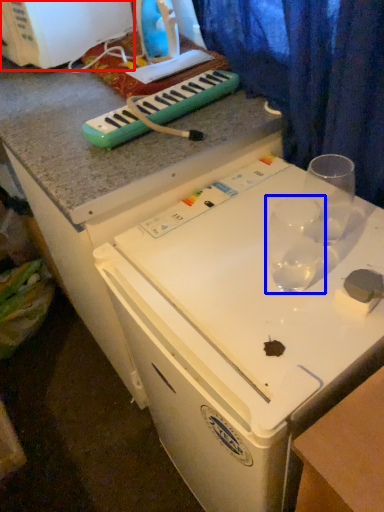
Question: Which object is closer to the camera taking this photo, appliance (highlighted by a red box) or martini glass (highlighted by a blue box)?

Choices:
 (A) appliance
 (B) martini glass

Answer: (B)